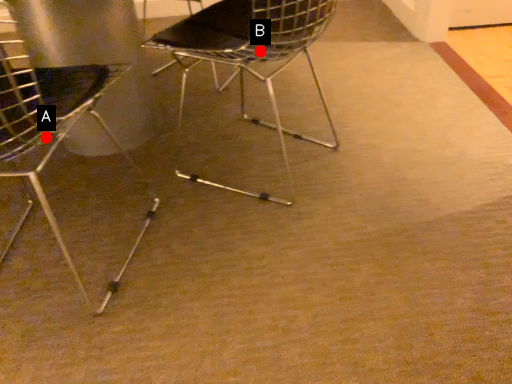
Question: Two points are circled on the image, labeled by A and B beside each circle. Which point appears farthest from the camera in this image?

Choices:
 (A) A is further
 (B) B is further

Answer: (B)